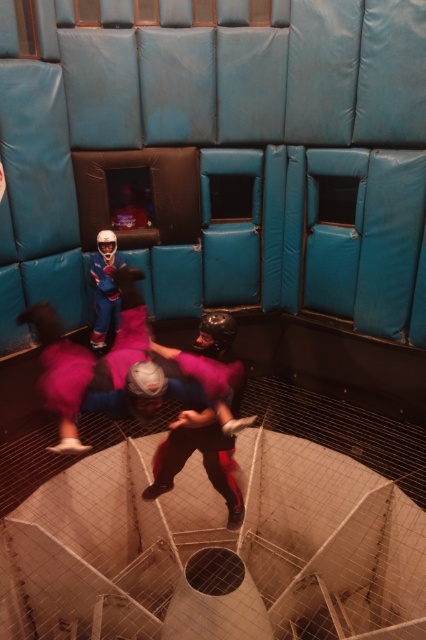
You are a safety inspector at the trampoline park. You notice two items at the center of the trampoline area. One is the pink fabric helmet at center and the other is the matte blue suit at center. According to safety regulations, helmets must be worn at all times. Is there a violation here?

The pink fabric helmet at center is located below matte blue suit at center, which suggests the helmet is not being worn properly. This violates the safety rule requiring helmets to be worn at all times.

You are a safety inspector at the trampoline park. You need to ensure that all participants are within a 2 meter safety distance from each other. You see the pink fabric helmet at center and the matte blue suit at center. Are they within the required safety distance?

The pink fabric helmet at center and the matte blue suit at center are 2.44 meters apart from each other, which exceeds the 2 meter safety distance requirement. Therefore, they are not within the required safety distance.

You are planning to place a new safety sign in the trampoline park. The sign must be placed at a position that is not occupied by any object. The park has a coordinate system where the bottom left corner is the origin point. The sign must be placed at least 0.1 units away from any object. Given the coordinates of the pink fabric helmet at center at point (204, 417), can you suggest a valid coordinate for the safety sign?

The pink fabric helmet at center is located at point (204, 417). To ensure the safety sign is placed at least 0.1 units away, a valid coordinate could be 0.553, 0.381, which is 0.1 units to the left and down from the helmet location.